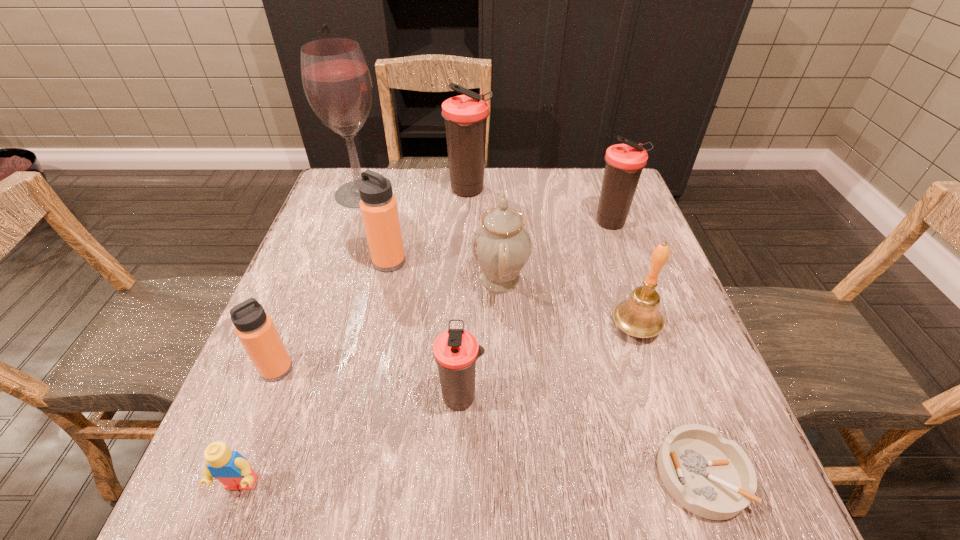
Find the location of a particular element. The height and width of the screenshot is (540, 960). the nearest brown thermos bottle is located at coordinates (455, 351).

Where is `the left orange thermos bottle`? the left orange thermos bottle is located at coordinates (255, 329).

Identify the location of the smaller orange thermos bottle. (255, 329).

Identify the location of yellow Lego. The width and height of the screenshot is (960, 540). (234, 471).

What are the coordinates of `the ninth tallest object` in the screenshot? It's located at (234, 471).

Locate an element on the screen. the shortest object is located at coordinates 710,476.

The width and height of the screenshot is (960, 540). In order to click on vacant space situated on the right of the alcohol in this screenshot , I will do `click(463, 193)`.

You are a GUI agent. You are given a task and a screenshot of the screen. Output one action in this format:
    pyautogui.click(x=<x>, y=<y>)
    Task: Click on the free spot located 0.350m on the right of the biggest brown thermos bottle
    
    Given the screenshot: What is the action you would take?
    pyautogui.click(x=612, y=191)

The height and width of the screenshot is (540, 960). I want to click on free location located on the front of the rightmost thermos bottle, so click(x=622, y=252).

The image size is (960, 540). Identify the location of vacant space located 0.240m on the back of the right orange thermos bottle. pos(403,196).